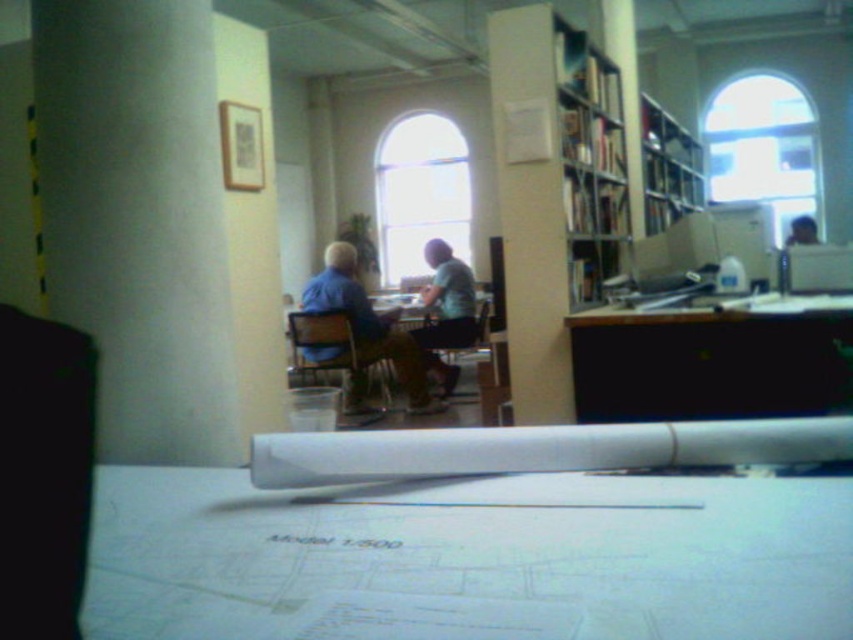
Question: Which object is farther from the camera taking this photo?

Choices:
 (A) white paper at center
 (B) black glossy table at center
 (C) wooden bookshelf at center

Answer: (C)

Question: Which object is the farthest from the light blue fabric shirt at center?

Choices:
 (A) smooth plastic cup at upper right
 (B) wooden bookshelf at center

Answer: (A)

Question: Does blue fabric shirt at center appear under wooden bookshelf at upper right?

Choices:
 (A) no
 (B) yes

Answer: (B)

Question: Is wooden bookshelf at center below black glossy table at center?

Choices:
 (A) yes
 (B) no

Answer: (B)

Question: Estimate the real-world distances between objects in this image. Which object is farther from the white paper at center?

Choices:
 (A) blue fabric shirt at center
 (B) light blue fabric shirt at center
 (C) smooth plastic cup at upper right

Answer: (C)

Question: Is wooden bookshelf at center thinner than wooden bookshelf at upper right?

Choices:
 (A) yes
 (B) no

Answer: (A)